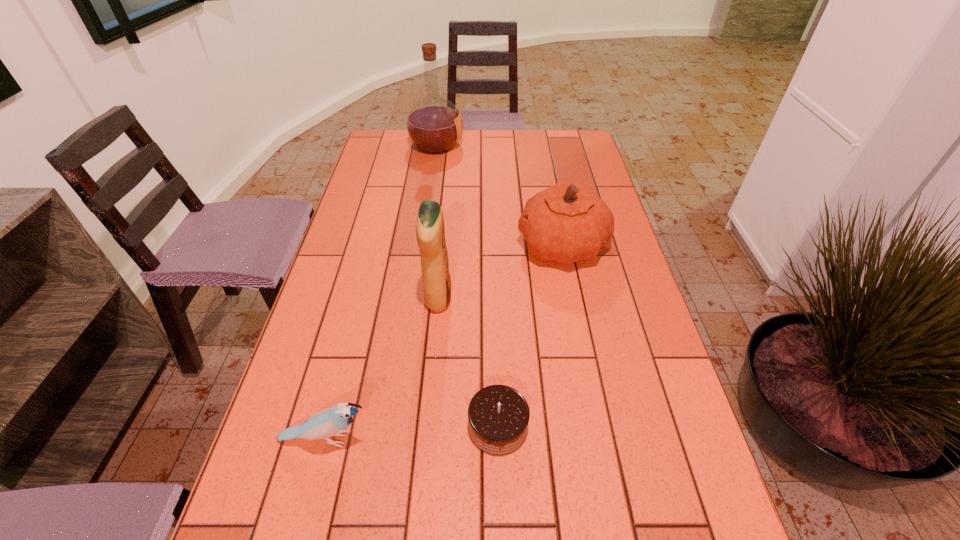
You are a GUI agent. You are given a task and a screenshot of the screen. Output one action in this format:
    pyautogui.click(x=<x>, y=<y>)
    Task: Click on the blank region between the fourth nearest object and the second object from right to left
    This screenshot has width=960, height=540.
    Given the screenshot: What is the action you would take?
    pyautogui.click(x=530, y=335)

This screenshot has height=540, width=960. I want to click on vacant area between the rightmost object and the detergent, so click(x=500, y=272).

At what (x,y) coordinates should I click in order to perform the action: click on free space between the second tallest object and the rightmost object. Please return your answer as a coordinate pair (x, y). This screenshot has height=540, width=960. Looking at the image, I should click on (500, 272).

Find the location of `free area in between the bird and the chocolate cake`. free area in between the bird and the chocolate cake is located at coordinates (412, 433).

Identify the location of free space between the chocolate cake and the third nearest object. The height and width of the screenshot is (540, 960). (468, 362).

Select which object appears as the second closest to the liquor. Please provide its 2D coordinates. Your answer should be formatted as a tuple, i.e. [(x, y)], where the tuple contains the x and y coordinates of a point satisfying the conditions above.

[(430, 232)]

Where is `object that is the closest to the fourth tallest object`? This screenshot has height=540, width=960. object that is the closest to the fourth tallest object is located at coordinates (498, 415).

The height and width of the screenshot is (540, 960). Identify the location of vacant space that satisfies the following two spatial constraints: 1. on the front label of the second object from right to left; 2. on the right side of the farthest object. 396,426.

Identify the location of vacant space that satisfies the following two spatial constraints: 1. on the label of the chocolate cake; 2. on the right side of the second tallest object. The width and height of the screenshot is (960, 540). (427, 426).

Where is `vacant point that satisfies the following two spatial constraints: 1. on the front label of the tallest object; 2. on the back side of the fourth object from left to right`? This screenshot has width=960, height=540. vacant point that satisfies the following two spatial constraints: 1. on the front label of the tallest object; 2. on the back side of the fourth object from left to right is located at coordinates (396, 426).